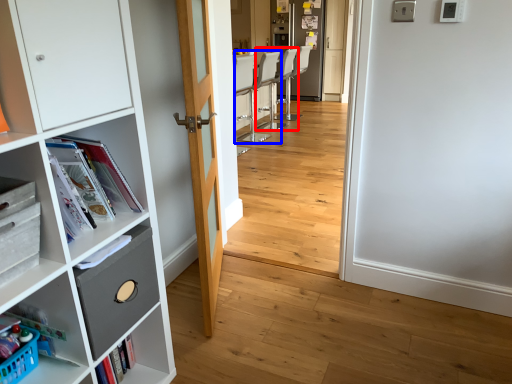
Question: Which point is further to the camera, armchair (highlighted by a red box) or chair (highlighted by a blue box)?

Choices:
 (A) armchair
 (B) chair

Answer: (A)